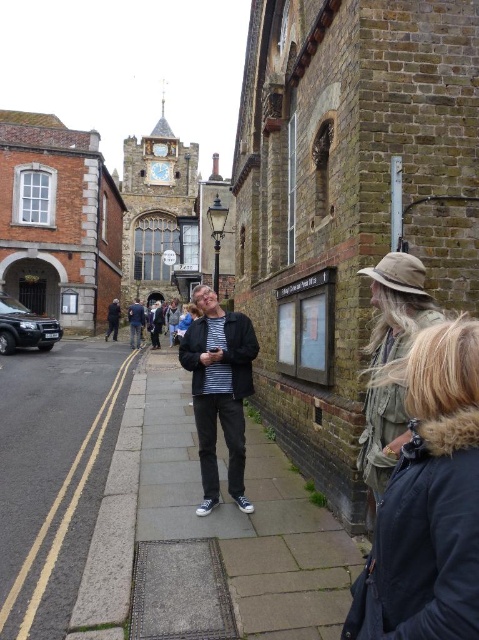
Between gray concrete sidewalk at lower left and striped shirt at center, which one is positioned higher?

striped shirt at center is higher up.

Is point (102, 392) farther from viewer compared to point (114, 301)?

No, it is not.

Where is `gray concrete sidewalk at lower left`? The width and height of the screenshot is (479, 640). gray concrete sidewalk at lower left is located at coordinates (54, 476).

How distant is dark blue jacket at center from striped shirt at center?

dark blue jacket at center and striped shirt at center are 10.47 meters apart.

Can you confirm if dark blue jacket at center is wider than striped shirt at center?

Yes, dark blue jacket at center is wider than striped shirt at center.

Does point (136, 326) come closer to viewer compared to point (115, 301)?

Yes, it is in front of point (115, 301).

Where is `dark blue jacket at center`? The image size is (479, 640). dark blue jacket at center is located at coordinates (136, 323).

Can you confirm if gray concrete sidewalk at lower left is positioned to the left of matte black jacket at center?

Indeed, gray concrete sidewalk at lower left is positioned on the left side of matte black jacket at center.

Who is more forward, (6, 440) or (212, 456)?

Point (212, 456) is more forward.

Measure the distance between point (27, 381) and camera.

A distance of 50.57 meters exists between point (27, 381) and camera.

Find the location of `gray concrete sidewalk at lower left`. gray concrete sidewalk at lower left is located at coordinates (54, 476).